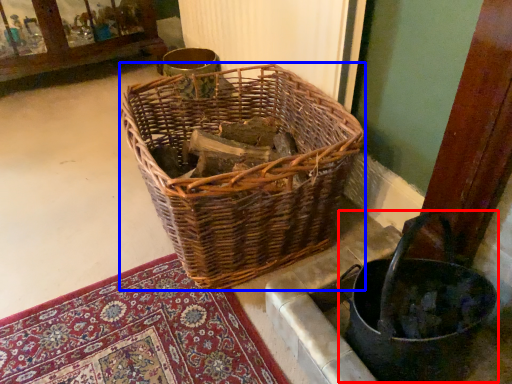
Question: Among these objects, which one is farthest to the camera, basket container (highlighted by a red box) or picnic basket (highlighted by a blue box)?

Choices:
 (A) basket container
 (B) picnic basket

Answer: (B)